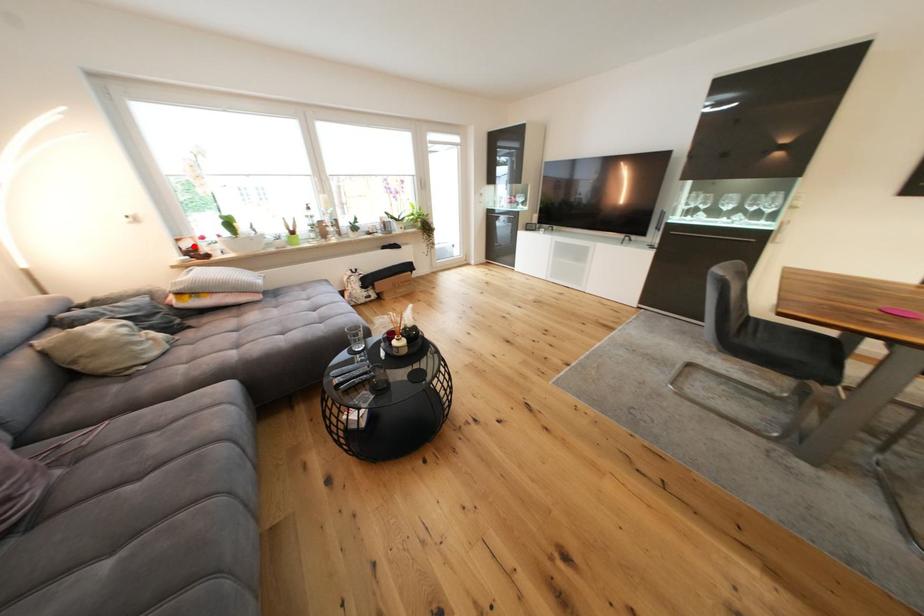
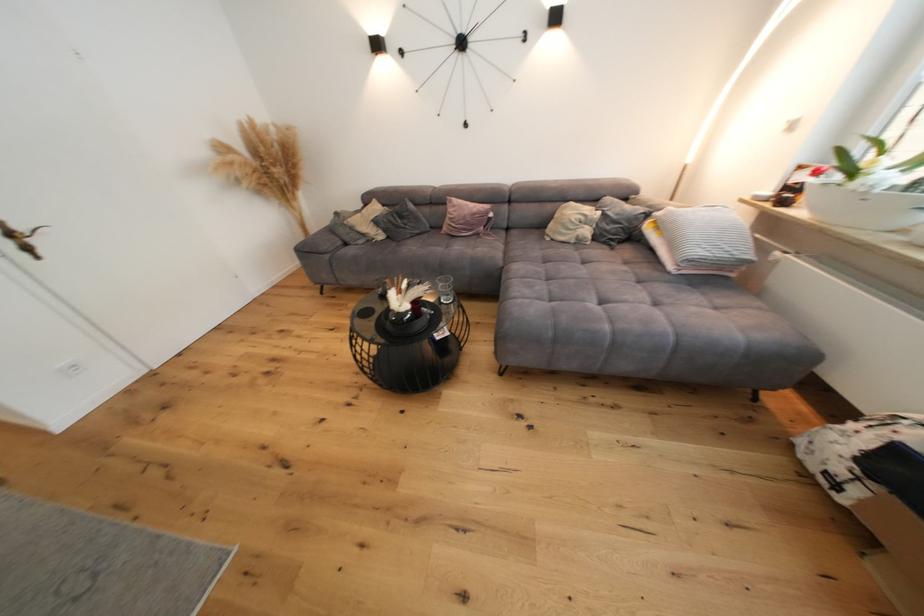
In the second image, find the point that corresponds to the highlighted location in the first image.

(809, 179)